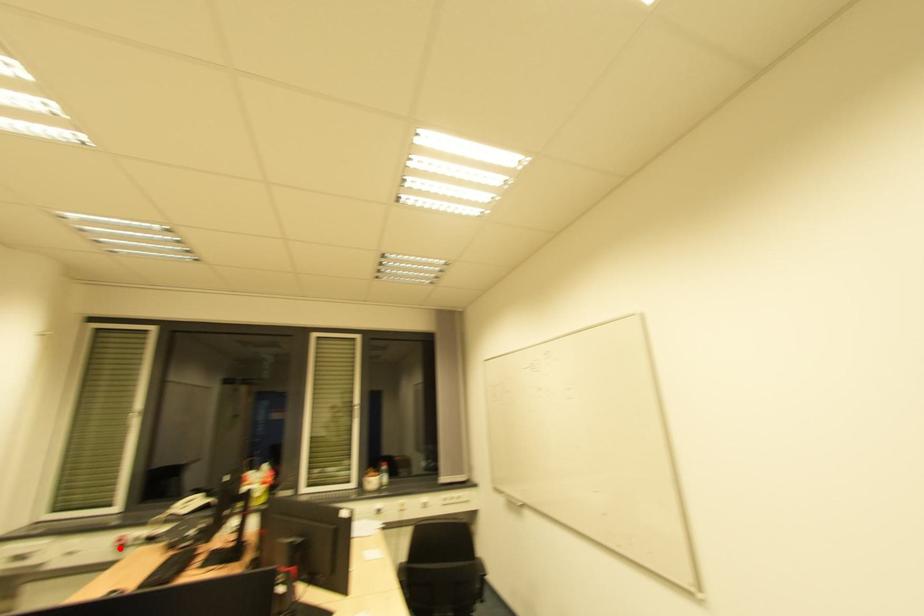
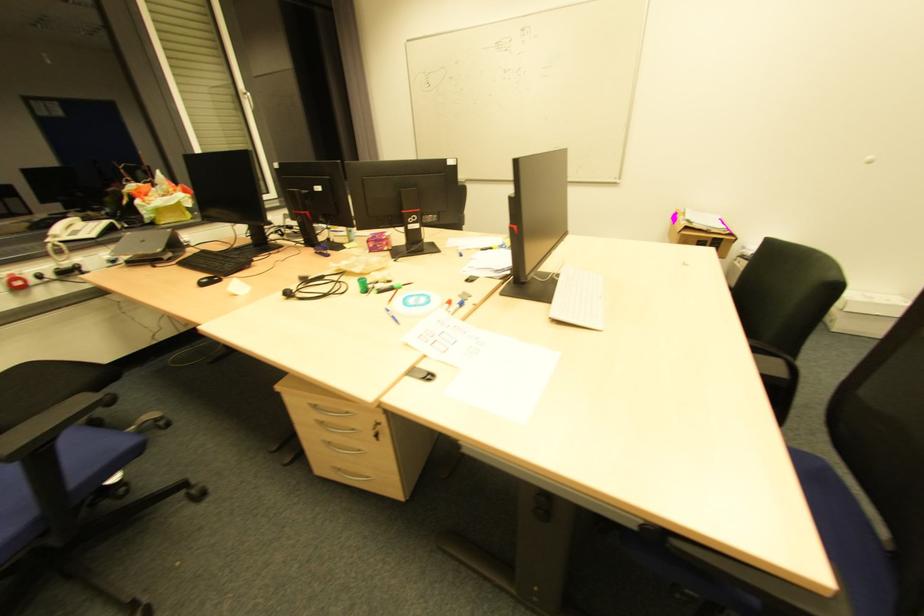
Where in the second image is the point corresponding to the highlighted location from the first image?

(17, 290)